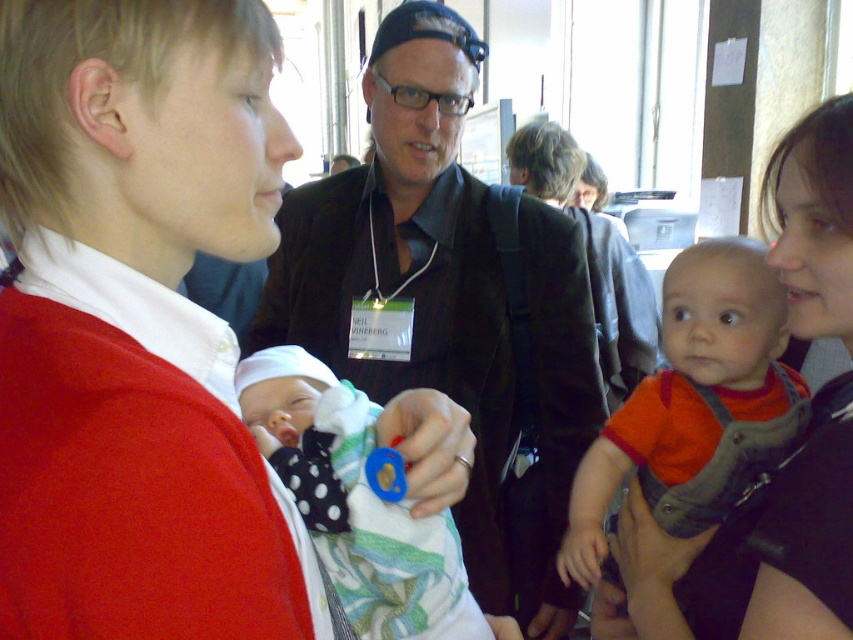
Does matte black baby carrier at center have a smaller size compared to blue rubber pacifier at center?

No.

Who is positioned more to the right, matte black baby carrier at center or blue rubber pacifier at center?

matte black baby carrier at center is more to the right.

Where is `matte black baby carrier at center`? The image size is (853, 640). matte black baby carrier at center is located at coordinates (753, 552).

Measure the distance between matte black baby carrier at center and camera.

The distance of matte black baby carrier at center from camera is 28.35 inches.

Is matte black baby carrier at center wider than blue rubber teething ring at center?

Correct, the width of matte black baby carrier at center exceeds that of blue rubber teething ring at center.

Who is more distant from viewer, (622, 541) or (457, 458)?

Point (622, 541)

Identify the location of matte black baby carrier at center. The height and width of the screenshot is (640, 853). (753, 552).

Is matte black shirt at center to the right of blue rubber teething ring at center from the viewer's perspective?

In fact, matte black shirt at center is to the left of blue rubber teething ring at center.

Between matte black shirt at center and blue rubber teething ring at center, which one appears on the right side from the viewer's perspective?

Positioned to the right is blue rubber teething ring at center.

Which is in front, point (508, 532) or point (460, 456)?

Point (460, 456)

The image size is (853, 640). What are the coordinates of `matte black shirt at center` in the screenshot? It's located at (450, 305).